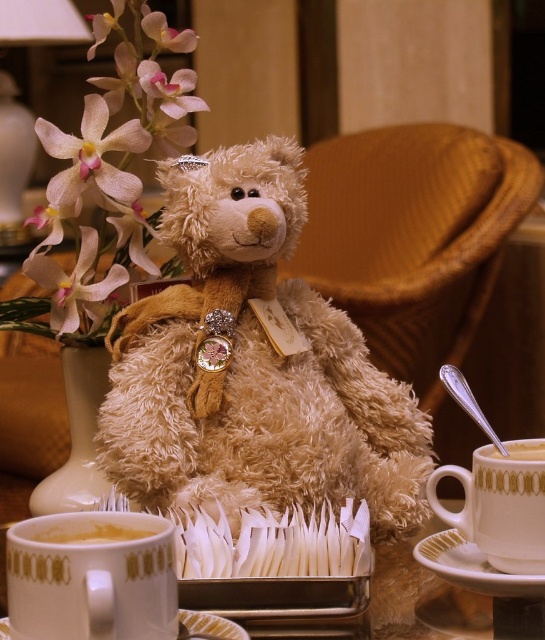
Question: Which point appears farthest from the camera in this image?

Choices:
 (A) (541, 452)
 (B) (433, 534)

Answer: (B)

Question: Does gold-patterned ceramic cup at right appear under white ceramic vase at center?

Choices:
 (A) no
 (B) yes

Answer: (B)

Question: Considering the relative positions of soft pink petals at upper left and white porcelain saucer at lower right in the image provided, where is soft pink petals at upper left located with respect to white porcelain saucer at lower right?

Choices:
 (A) below
 (B) above

Answer: (B)

Question: Which point is farther to the camera?

Choices:
 (A) (118, 531)
 (B) (94, 144)
 (C) (500, 508)

Answer: (B)

Question: Which object appears farthest from the camera in this image?

Choices:
 (A) white ceramic vase at center
 (B) white porcelain saucer at lower right

Answer: (A)

Question: Is fuzzy beige teddy bear at center further to camera compared to golden ceramic cup at lower right?

Choices:
 (A) yes
 (B) no

Answer: (B)